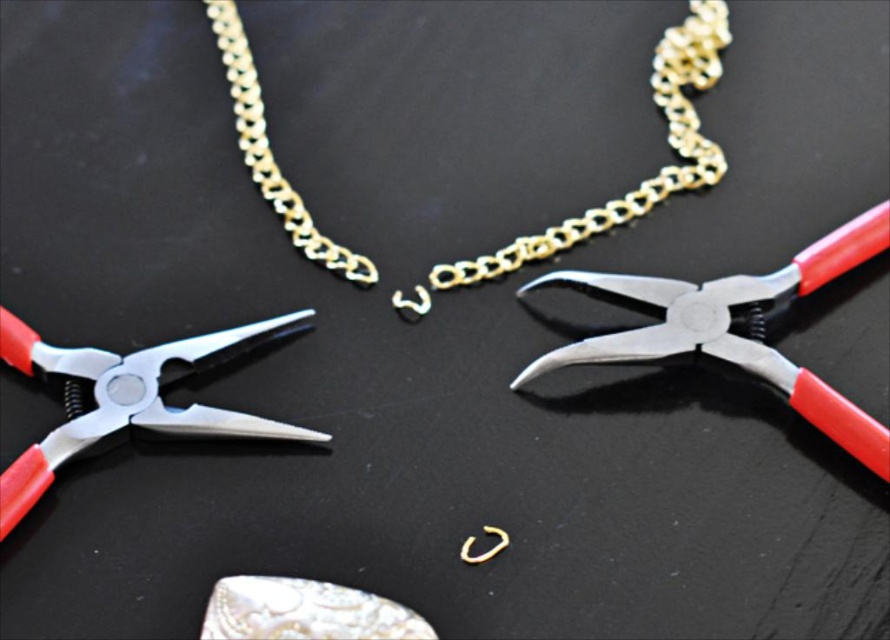
Who is lower down, metallic silver pliers at center or metallic red-handled pliers at center-left?

Positioned lower is metallic red-handled pliers at center-left.

Who is more distant from viewer, [672,288] or [15,465]?

The point [672,288] is behind.

This screenshot has height=640, width=890. In order to click on metallic silver pliers at center in this screenshot , I will do `click(735, 333)`.

Which is in front, point (369, 280) or point (270, 429)?

Point (270, 429) is in front.

This screenshot has height=640, width=890. Find the location of `gold shiny chain at center`. gold shiny chain at center is located at coordinates [x=642, y=180].

Between point (484, 256) and point (174, 413), which one is positioned in front?

Point (174, 413) is more forward.

In order to click on gold shiny chain at center in this screenshot , I will do `click(642, 180)`.

Is gold shiny chain at center closer to the viewer compared to metallic silver pliers at center?

No, gold shiny chain at center is behind metallic silver pliers at center.

Who is more forward, [617,220] or [828,408]?

Positioned in front is point [828,408].

This screenshot has height=640, width=890. What do you see at coordinates (642, 180) in the screenshot? I see `gold shiny chain at center` at bounding box center [642, 180].

Find the location of `gold shiny chain at center`. gold shiny chain at center is located at coordinates (642, 180).